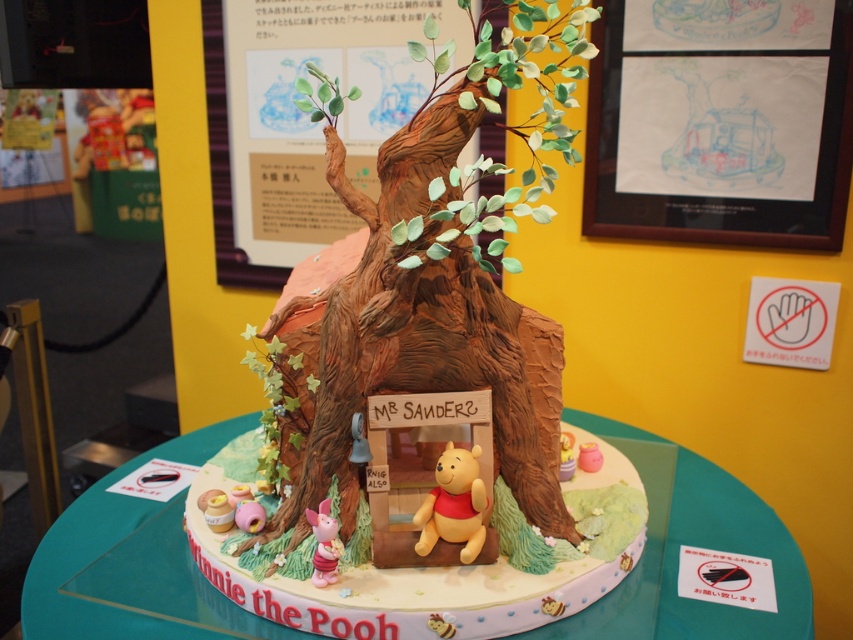
Question: Which point is farther to the camera?

Choices:
 (A) (334, 536)
 (B) (567, 468)
 (C) (296, 458)
 (D) (422, 509)

Answer: (B)

Question: Is the position of yellow matte winnie the pooh at center more distant than that of matte brown bear at center?

Choices:
 (A) yes
 (B) no

Answer: (B)

Question: Is the position of yellow matte winnie the pooh at center more distant than that of matte brown bear at center?

Choices:
 (A) no
 (B) yes

Answer: (A)

Question: Estimate the real-world distances between objects in this image. Which object is farther from the smooth teal cake at center?

Choices:
 (A) yellow matte winnie the pooh at center
 (B) matte brown treehouse at center
 (C) pink glossy piglet at lower left

Answer: (C)

Question: Can you confirm if yellow matte winnie the pooh at center is bigger than matte brown bear at center?

Choices:
 (A) yes
 (B) no

Answer: (A)

Question: Which object is closer to the camera taking this photo?

Choices:
 (A) yellow matte winnie the pooh at center
 (B) matte brown treehouse at center
 (C) smooth teal cake at center
 (D) matte brown bear at center

Answer: (B)